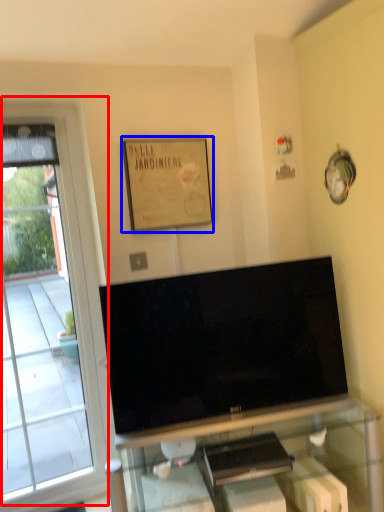
Question: Which of the following is the farthest to the observer, window (highlighted by a red box) or picture frame (highlighted by a blue box)?

Choices:
 (A) window
 (B) picture frame

Answer: (B)